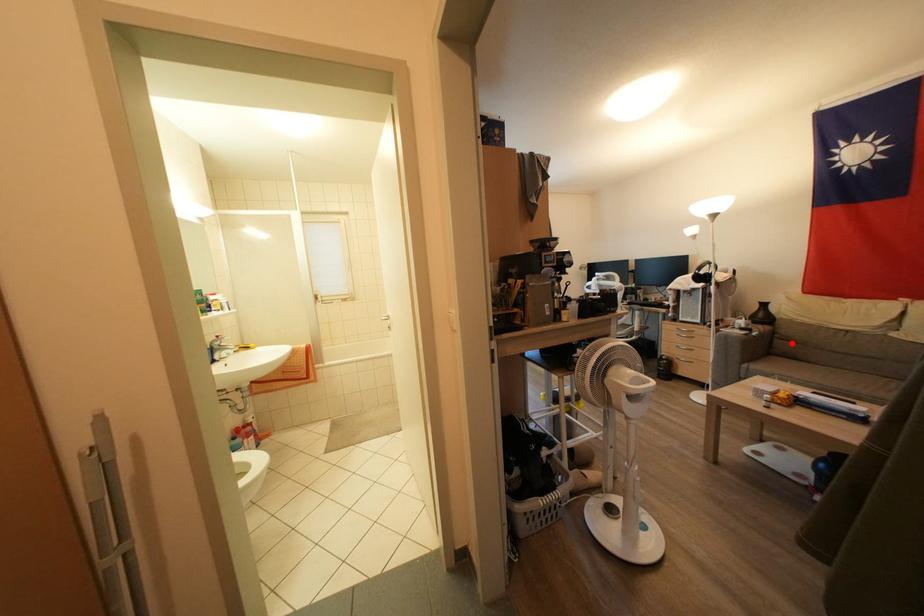
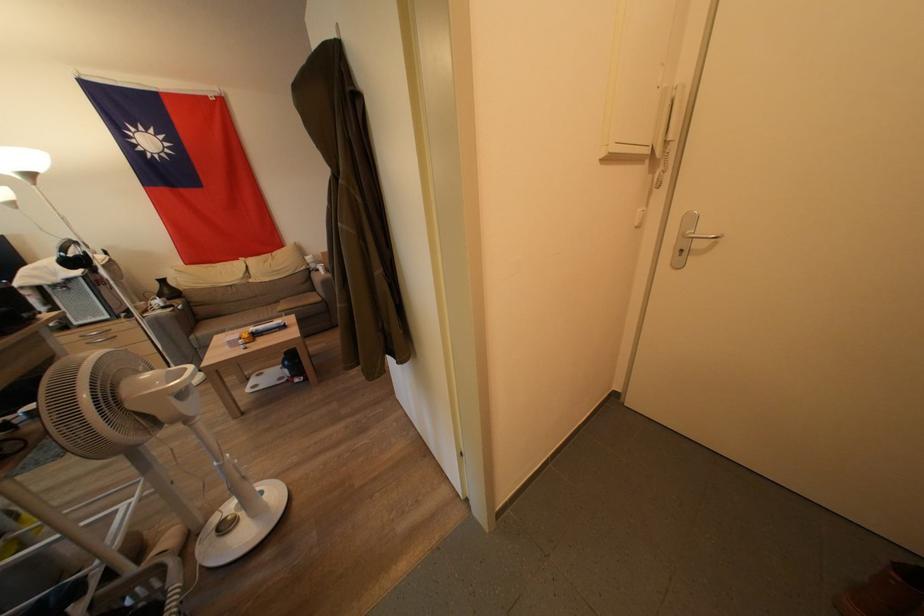
Question: I am providing you with two images of the same scene from different viewpoints. In image1, a red point is highlighted. Considering the same 3D point in image2, which of the following is correct?

Choices:
 (A) It is closer
 (B) It is farther

Answer: (A)